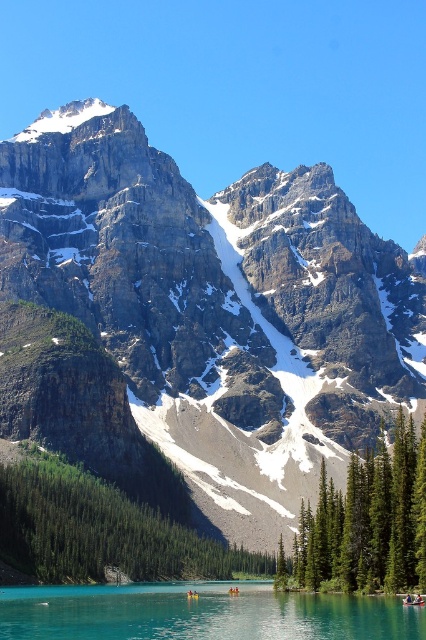
In the scene shown: Between rocky gray mountain at center and green textured tree at center, which one has less height?

green textured tree at center

Between point (400, 280) and point (356, 458), which one is positioned in front?

Point (356, 458) is in front.

Identify the location of rocky gray mountain at center. (218, 307).

Is green leafy trees at lower left taller than green textured tree at center?

No, green leafy trees at lower left is not taller than green textured tree at center.

Does green leafy trees at lower left have a smaller size compared to green textured tree at center?

Correct, green leafy trees at lower left occupies less space than green textured tree at center.

The width and height of the screenshot is (426, 640). Find the location of `green leafy trees at lower left`. green leafy trees at lower left is located at coordinates (101, 531).

Is turquoise glossy water at lower center to the right of green textured tree at center from the viewer's perspective?

In fact, turquoise glossy water at lower center is to the left of green textured tree at center.

Is turquoise glossy water at lower center to the left of green textured tree at center from the viewer's perspective?

Result: Indeed, turquoise glossy water at lower center is positioned on the left side of green textured tree at center.

Describe the element at coordinates (201, 612) in the screenshot. I see `turquoise glossy water at lower center` at that location.

Where is `turquoise glossy water at lower center`? turquoise glossy water at lower center is located at coordinates (201, 612).